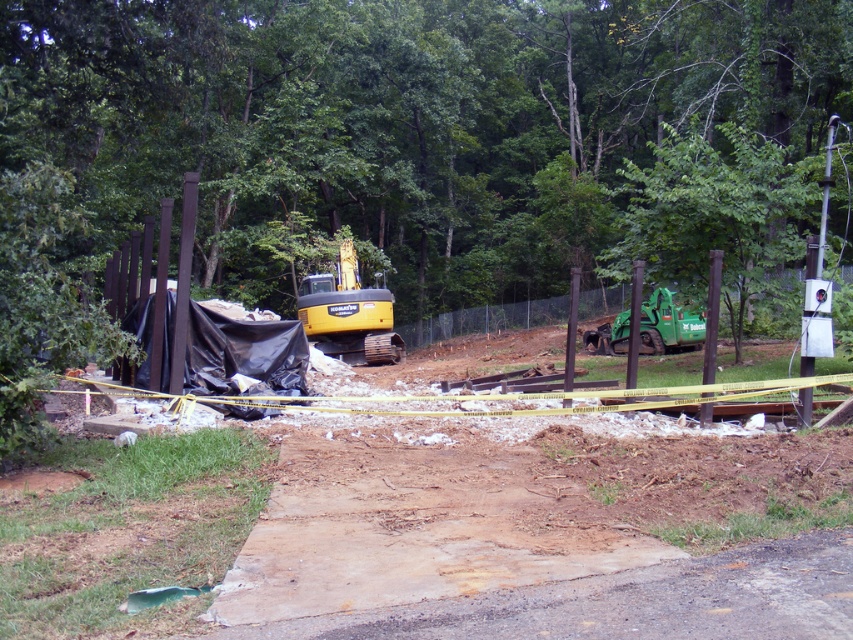
Between green leafy tree at upper center and yellow rubber excavator at center, which one is positioned higher?

green leafy tree at upper center is higher up.

Between green leafy tree at upper center and yellow rubber excavator at center, which one appears on the right side from the viewer's perspective?

From the viewer's perspective, green leafy tree at upper center appears more on the right side.

Identify the location of green leafy tree at upper center. (399, 122).

Identify the location of green leafy tree at upper center. The height and width of the screenshot is (640, 853). point(399,122).